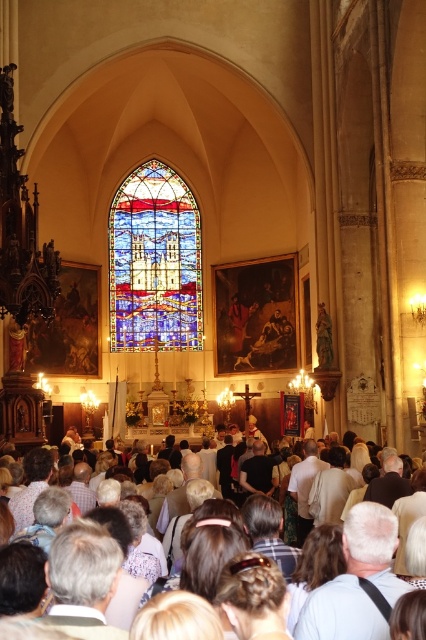
Looking at this image, does stained glass window at center appear under white clothed crowd at center?

Incorrect, stained glass window at center is not positioned below white clothed crowd at center.

Is stained glass window at center to the right of white clothed crowd at center from the viewer's perspective?

In fact, stained glass window at center is to the left of white clothed crowd at center.

What do you see at coordinates (155, 262) in the screenshot?
I see `stained glass window at center` at bounding box center [155, 262].

The height and width of the screenshot is (640, 426). What are the coordinates of `stained glass window at center` in the screenshot? It's located at (155, 262).